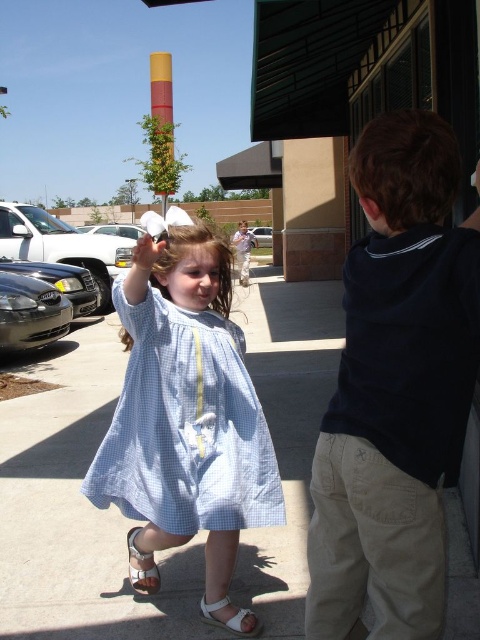
Can you confirm if dark blue shirt at right is positioned to the left of brown curly hair at upper right?

No, dark blue shirt at right is not to the left of brown curly hair at upper right.

Who is positioned more to the right, dark blue shirt at right or brown curly hair at upper right?

From the viewer's perspective, dark blue shirt at right appears more on the right side.

Locate an element on the screen. Image resolution: width=480 pixels, height=640 pixels. dark blue shirt at right is located at coordinates (395, 388).

Where is `dark blue shirt at right`? The image size is (480, 640). dark blue shirt at right is located at coordinates [x=395, y=388].

Between light blue gingham dress at center and brown smooth hair at center, which one is positioned lower?

light blue gingham dress at center is lower down.

Between point (168, 324) and point (217, 296), which one is positioned in front?

Point (168, 324) is more forward.

Between point (207, 458) and point (220, 260), which one is positioned in front?

Positioned in front is point (207, 458).

Image resolution: width=480 pixels, height=640 pixels. I want to click on light blue gingham dress at center, so click(187, 410).

How much distance is there between white concrete pavement at center and light blue gingham dress at center?

white concrete pavement at center and light blue gingham dress at center are 1.88 meters apart from each other.

Does white concrete pavement at center have a lesser width compared to light blue gingham dress at center?

No, white concrete pavement at center is not thinner than light blue gingham dress at center.

Is point (317, 320) in front of point (188, 456)?

No, it is not.

Find the location of `white concrete pavement at center`. white concrete pavement at center is located at coordinates (76, 512).